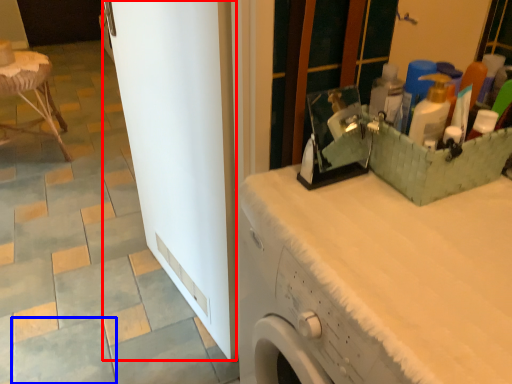
Question: Which object is closer to the camera taking this photo, screen door (highlighted by a red box) or ceramic tile (highlighted by a blue box)?

Choices:
 (A) screen door
 (B) ceramic tile

Answer: (A)